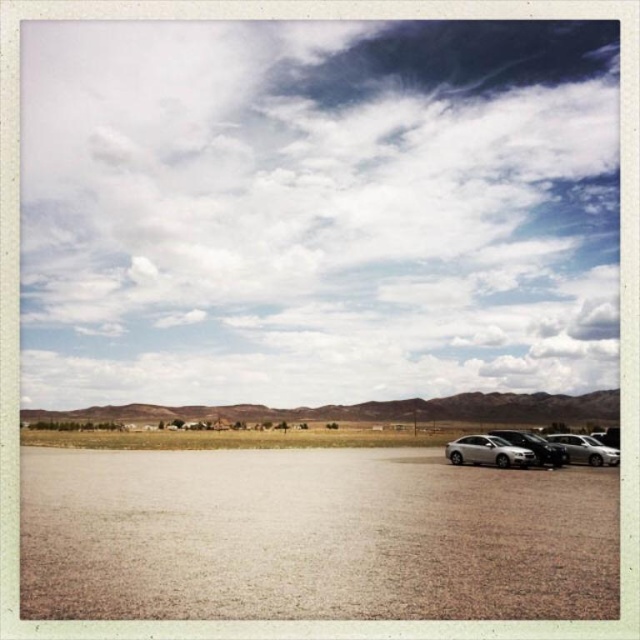
You are planning to park your car on the brown sandy dirt field at lower center. Considering the size of the satin silver sedan at lower right, will the field be wide enough to accommodate your car?

The brown sandy dirt field at lower center has a larger width than the satin silver sedan at lower right, so yes, the field will be wide enough to accommodate your car.